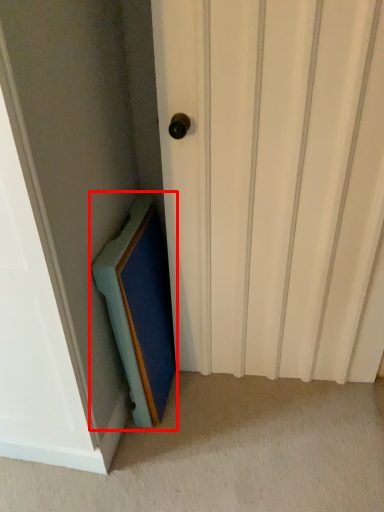
Question: In this image, where is medicine cabinet (annotated by the red box) located relative to door?

Choices:
 (A) right
 (B) left

Answer: (B)